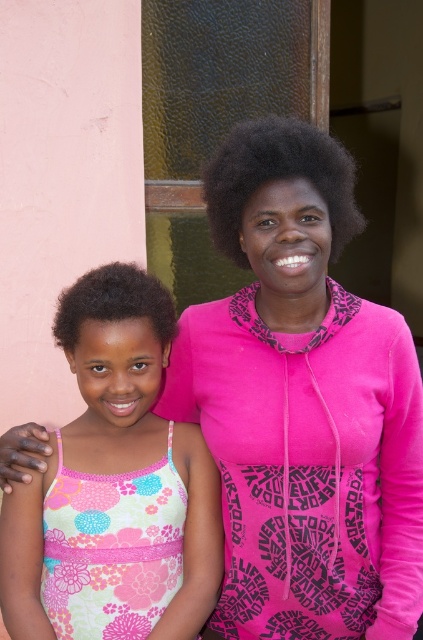
Question: Does floral fabric dress at center have a greater width compared to black curly hair at center?

Choices:
 (A) yes
 (B) no

Answer: (A)

Question: Which point is farther to the camera?

Choices:
 (A) (120, 440)
 (B) (99, 593)

Answer: (A)

Question: Which point appears farthest from the camera in this image?

Choices:
 (A) (213, 557)
 (B) (109, 276)

Answer: (A)

Question: Is black curly hair at center thinner than dark curly hair at center?

Choices:
 (A) no
 (B) yes

Answer: (A)

Question: Which of the following is the closest to the observer?

Choices:
 (A) dark curly hair at center
 (B) black curly hair at center
 (C) floral fabric dress at center

Answer: (C)

Question: Is floral fabric dress at center to the right of dark curly hair at center from the viewer's perspective?

Choices:
 (A) yes
 (B) no

Answer: (A)